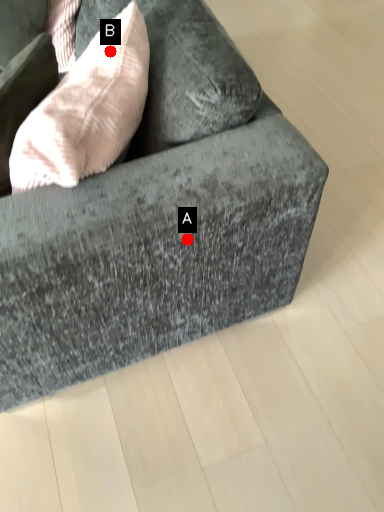
Question: Two points are circled on the image, labeled by A and B beside each circle. Which point is closer to the camera taking this photo?

Choices:
 (A) A is closer
 (B) B is closer

Answer: (A)